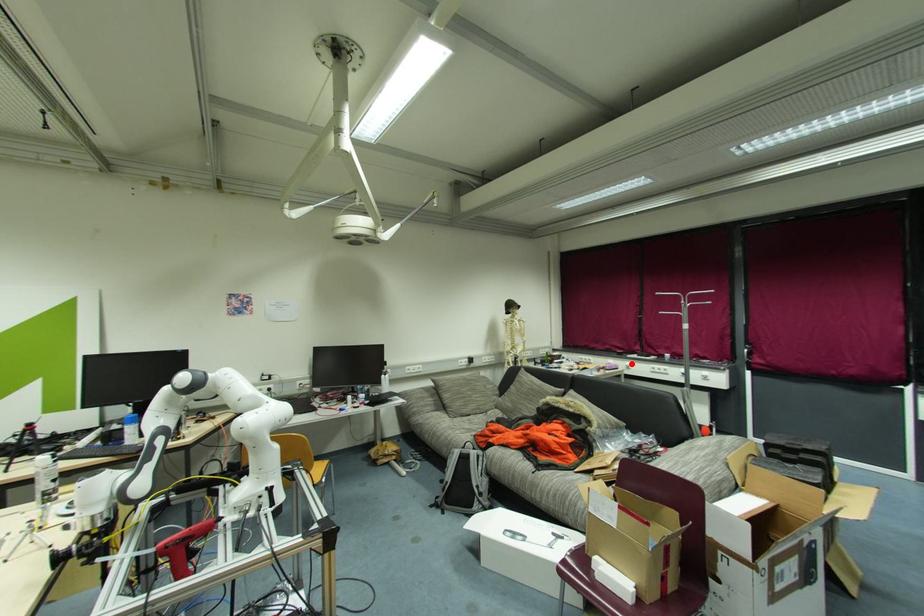
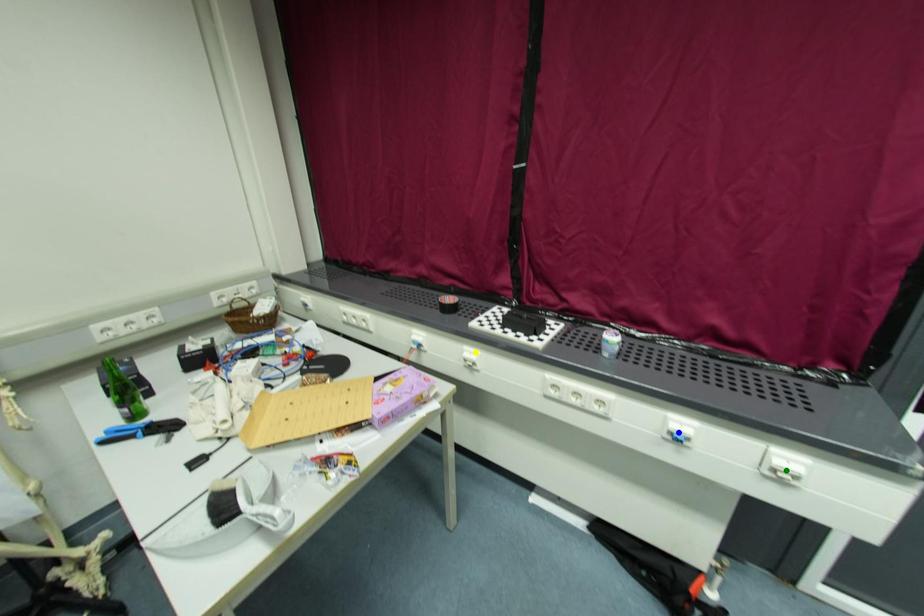
Question: I am providing you with two images of the same scene from different viewpoints. A red point is marked on the first image. You are given multiple points on the second image. Which point in image 2 represents the same 3d spot as the red point in image 1?

Choices:
 (A) yellow point
 (B) green point
 (C) blue point

Answer: (A)